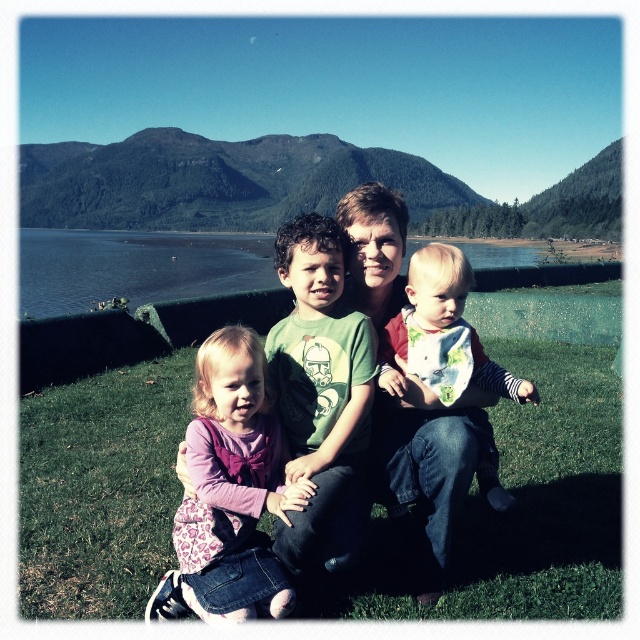
Question: Considering the real-world distances, which object is closest to the green matte shirt at center?

Choices:
 (A) matte green t-shirt at center
 (B) green grass at center

Answer: (A)

Question: Can you confirm if matte green t-shirt at center is positioned to the left of green matte shirt at center?

Choices:
 (A) no
 (B) yes

Answer: (A)

Question: Does pink fabric dress at center appear under white cotton shirt at center?

Choices:
 (A) yes
 (B) no

Answer: (A)

Question: Which object is positioned farthest from the green cotton shirt at center?

Choices:
 (A) green grass at center
 (B) pink fabric dress at center

Answer: (A)

Question: Which is farther from the pink fabric dress at center?

Choices:
 (A) white cotton shirt at center
 (B) green cotton shirt at center

Answer: (A)

Question: Is green matte shirt at center above green cotton shirt at center?

Choices:
 (A) no
 (B) yes

Answer: (B)